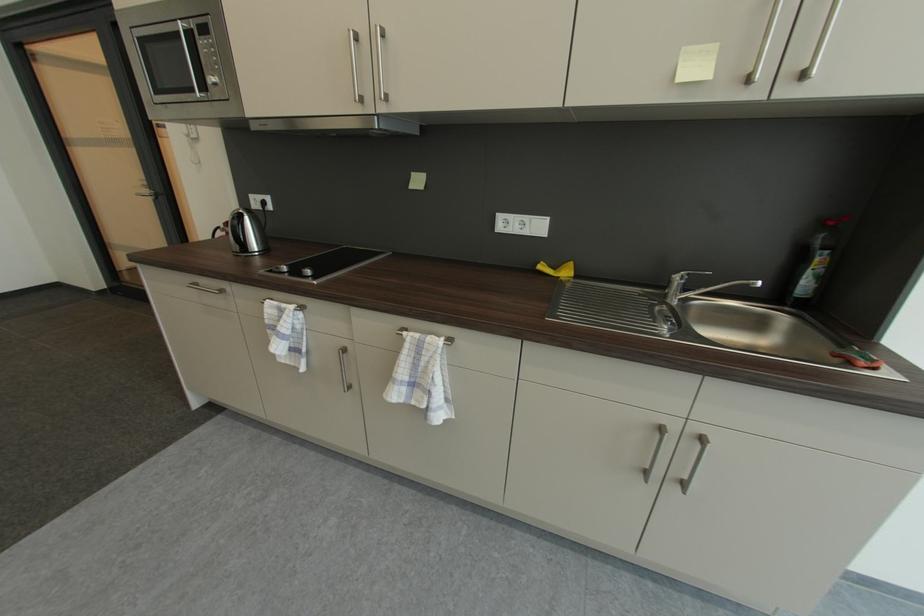
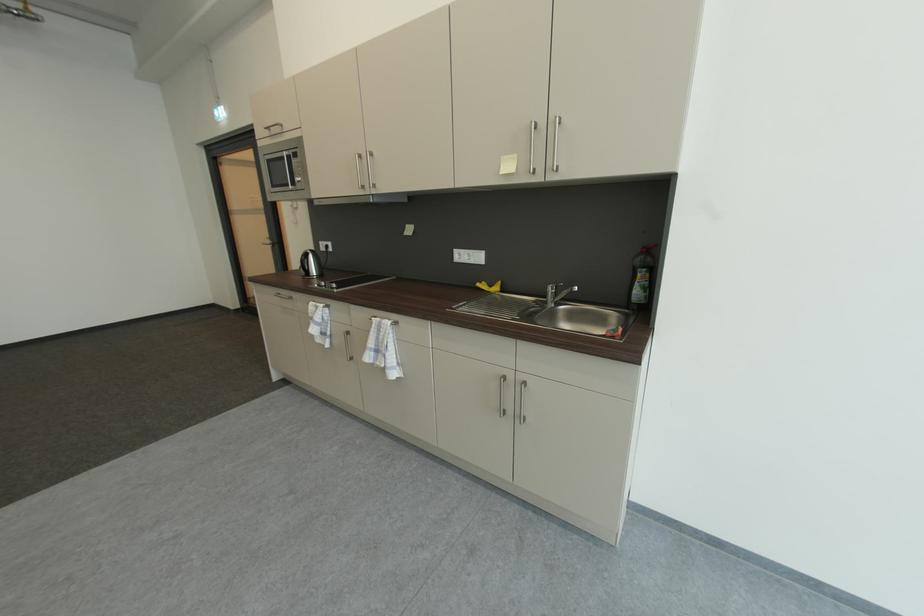
The point at (242, 224) is marked in the first image. Where is the corresponding point in the second image?

(310, 259)